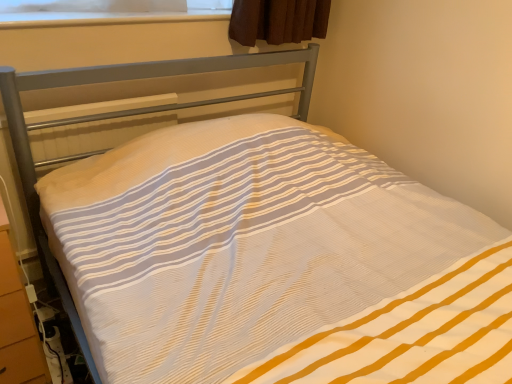
Question: Do you think orange wood dresser at lower left is within transparent plastic at upper center, or outside of it?

Choices:
 (A) outside
 (B) inside

Answer: (A)

Question: In terms of size, does orange wood dresser at lower left appear bigger or smaller than transparent plastic at upper center?

Choices:
 (A) big
 (B) small

Answer: (A)

Question: Considering their positions, is orange wood dresser at lower left located in front of or behind transparent plastic at upper center?

Choices:
 (A) behind
 (B) front

Answer: (B)

Question: Is transparent plastic at upper center situated inside orange wood dresser at lower left or outside?

Choices:
 (A) outside
 (B) inside

Answer: (A)

Question: From the image's perspective, is transparent plastic at upper center located above or below orange wood dresser at lower left?

Choices:
 (A) above
 (B) below

Answer: (A)

Question: From their relative heights in the image, would you say transparent plastic at upper center is taller or shorter than orange wood dresser at lower left?

Choices:
 (A) short
 (B) tall

Answer: (A)

Question: Looking at their shapes, would you say transparent plastic at upper center is wider or thinner than orange wood dresser at lower left?

Choices:
 (A) wide
 (B) thin

Answer: (B)